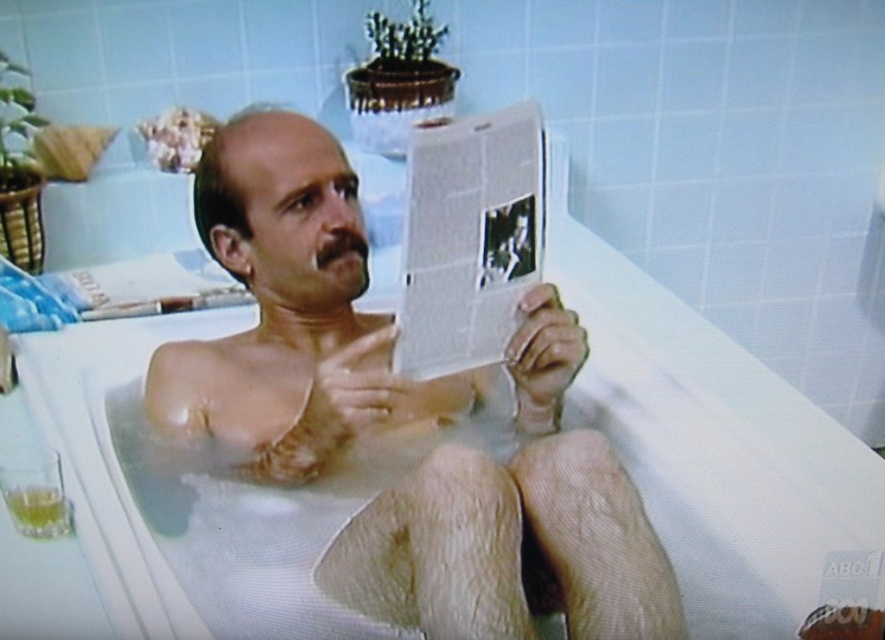
Question: Which object is farther from the camera taking this photo?

Choices:
 (A) smooth skin man at center
 (B) white glossy newspaper at center

Answer: (B)

Question: Is smooth skin man at center to the left of white glossy newspaper at center from the viewer's perspective?

Choices:
 (A) yes
 (B) no

Answer: (A)

Question: Is smooth skin man at center to the right of white glossy newspaper at center from the viewer's perspective?

Choices:
 (A) no
 (B) yes

Answer: (A)

Question: Which object is farther from the camera taking this photo?

Choices:
 (A) white glossy newspaper at center
 (B) smooth skin man at center

Answer: (A)

Question: Is smooth skin man at center wider than white glossy newspaper at center?

Choices:
 (A) no
 (B) yes

Answer: (B)